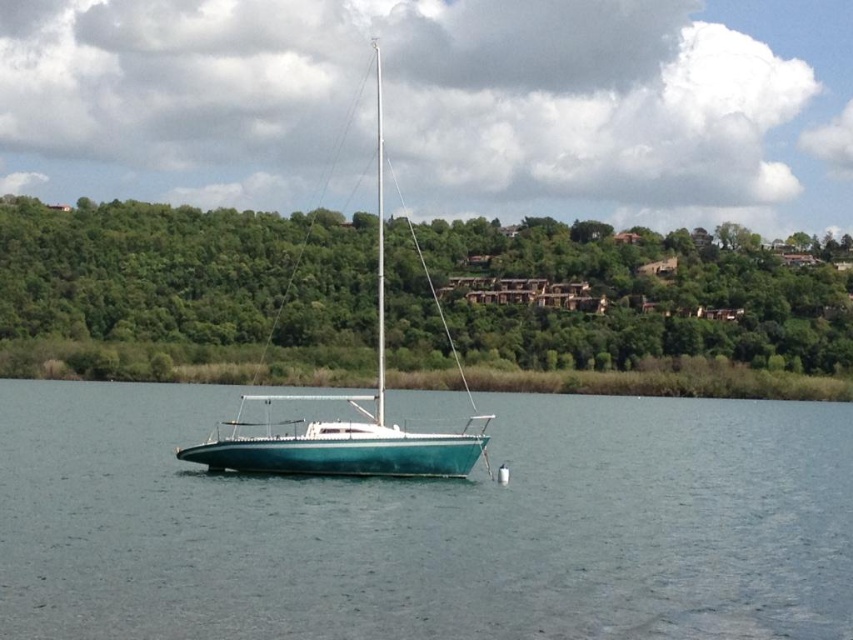
You are a photographer planning to capture the entire teal glossy sailboat at center and the green leafy trees at upper center in a single frame. Based on the scene, which object will occupy more horizontal space in the photo?

The green leafy trees at upper center will occupy more horizontal space in the photo since their width surpasses that of the teal glossy sailboat at center.

You are standing at the lakeside and want to reach the point marked as point (367, 253). The distance between you and the point is 240.79 meters. If you walk at a speed of 1.5 meters per second, how many minutes will it take you to reach the point?

It will take approximately 26.76 minutes to reach point (367, 253) since 240.79 meters divided by 1.5 meters per second equals 160.53 seconds, which converts to 2.6755 minutes. Wait, that math doesn t add up. Let me recalculate. 240.79 divided by 1.5 is actually 160.53 seconds. To convert seconds to minutes, divide by 60, so 160.53 divided by 60 equals approximately 2.6755 minutes, which rounds to about 2.68 minutes.

You are standing on the shore and want to know how far the teal glossy water at center is from you. Can you determine the distance?

The teal glossy water at center is 53.33 feet away from the viewer.